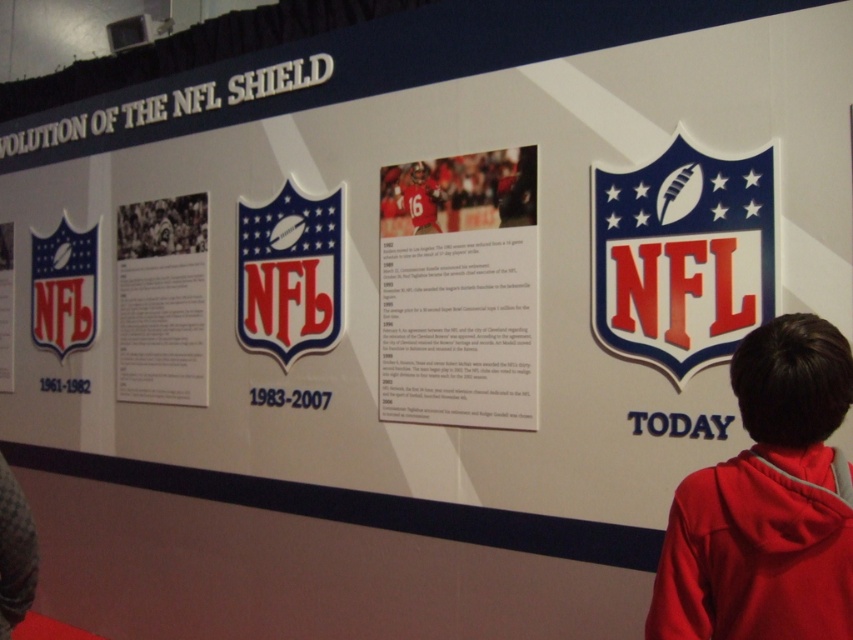
Question: Estimate the real-world distances between objects in this image. Which object is farther from the red fleece jacket at lower right?

Choices:
 (A) matte plastic nfl shield at upper right
 (B) matte jersey at center

Answer: (B)

Question: Which of these objects is positioned farthest from the red fleece jacket at lower right?

Choices:
 (A) matte plastic nfl shield at left
 (B) black paper at center
 (C) matte paper poster at center
 (D) matte jersey at center

Answer: (A)

Question: Is the position of matte plastic nfl shield at left more distant than that of white paper at upper left?

Choices:
 (A) no
 (B) yes

Answer: (A)

Question: Which point appears closest to the camera in this image?

Choices:
 (A) (527, 296)
 (B) (303, 330)
 (C) (409, 188)
 (D) (697, 490)

Answer: (D)

Question: Can you confirm if matte paper poster at center is positioned below white paper at upper left?

Choices:
 (A) no
 (B) yes

Answer: (A)

Question: Is black paper at center wider than matte jersey at center?

Choices:
 (A) yes
 (B) no

Answer: (A)